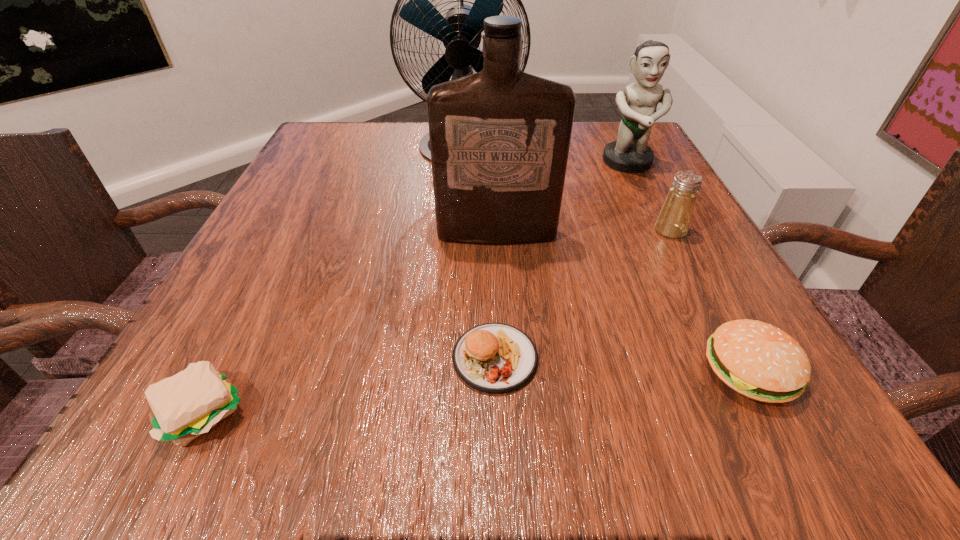
This screenshot has width=960, height=540. In order to click on vacant space located on the front of the saltshaker in this screenshot , I will do `click(694, 276)`.

In order to click on free space located 0.200m on the left of the rightmost patty in this screenshot , I will do `click(547, 370)`.

Where is `vacant region located on the back of the second patty from left to right`? vacant region located on the back of the second patty from left to right is located at coordinates (493, 295).

Where is `free location located 0.300m on the back of the leftmost object`? This screenshot has height=540, width=960. free location located 0.300m on the back of the leftmost object is located at coordinates (296, 231).

You are a GUI agent. You are given a task and a screenshot of the screen. Output one action in this format:
    pyautogui.click(x=<x>, y=<y>)
    Task: Click on the fan at the far edge
    The width and height of the screenshot is (960, 540).
    Given the screenshot: What is the action you would take?
    pyautogui.click(x=460, y=31)

Where is `figurine at the far edge`? Image resolution: width=960 pixels, height=540 pixels. figurine at the far edge is located at coordinates coord(630,153).

The image size is (960, 540). What are the coordinates of `object at the left edge` in the screenshot? It's located at (184, 406).

This screenshot has width=960, height=540. I want to click on figurine that is positioned at the right edge, so click(x=630, y=153).

Locate an element on the screen. saltshaker located at the right edge is located at coordinates (674, 218).

In order to click on patty situated at the right edge in this screenshot , I will do `click(760, 361)`.